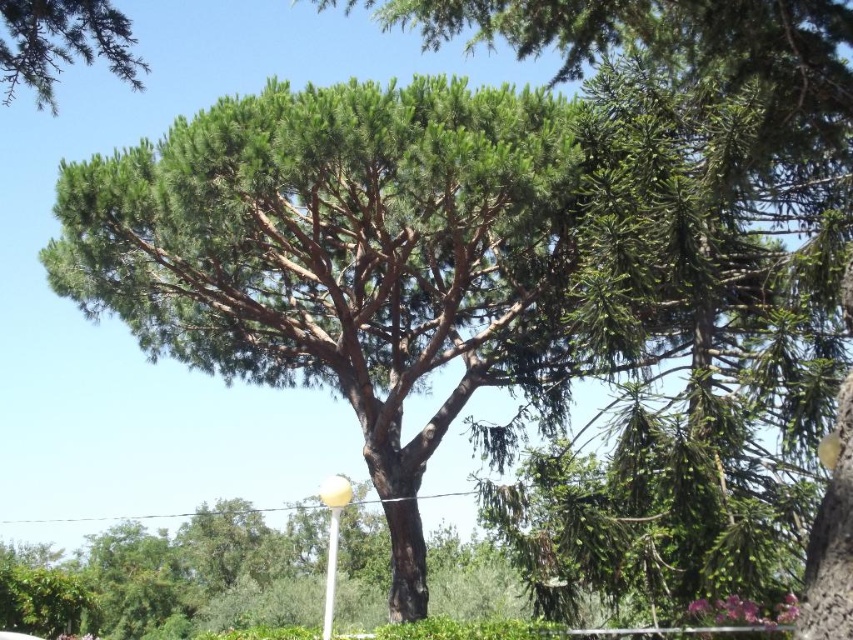
Measure the distance between green leafy tree at center and green needle-like at upper left.

green leafy tree at center is 6.19 meters from green needle-like at upper left.

Between green leafy tree at center and green needle-like at upper left, which one is positioned lower?

green leafy tree at center is below.

What do you see at coordinates (343, 256) in the screenshot? The width and height of the screenshot is (853, 640). I see `green leafy tree at center` at bounding box center [343, 256].

At what (x,y) coordinates should I click in order to perform the action: click on green leafy tree at center. Please return your answer as a coordinate pair (x, y). Looking at the image, I should click on (343, 256).

Between green needle-like at center and green needle-like at upper left, which one appears on the left side from the viewer's perspective?

green needle-like at upper left

Is green needle-like at center positioned before green needle-like at upper left?

Yes, green needle-like at center is closer to the viewer.

Does point (845, 106) come in front of point (126, 28)?

No, (845, 106) is further to viewer.

This screenshot has width=853, height=640. What are the coordinates of `green needle-like at center` in the screenshot? It's located at (782, 44).

Which is more to the left, green leafy tree at center or green needle-like at center?

green leafy tree at center

Where is `green leafy tree at center`? Image resolution: width=853 pixels, height=640 pixels. green leafy tree at center is located at coordinates 343,256.